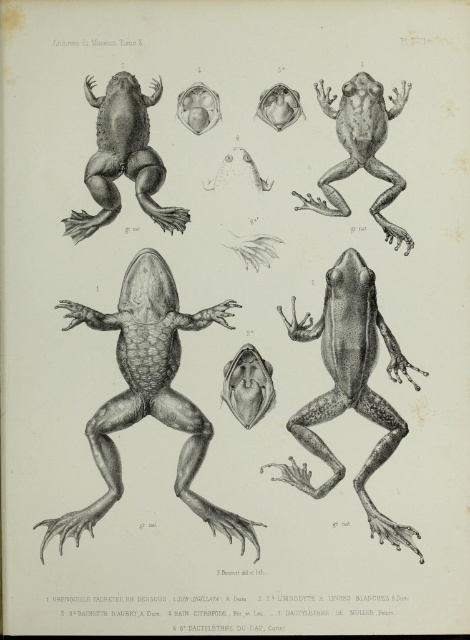
Is point (343, 410) farther from camera compared to point (345, 145)?

No, (343, 410) is in front of (345, 145).

Locate an element on the screen. The image size is (470, 640). gray textured frog at center is located at coordinates (350, 385).

Which is below, smooth black frog at upper left or smooth gray frog at upper right?

smooth gray frog at upper right is lower down.

Can you confirm if smooth black frog at upper left is bigger than smooth gray frog at upper right?

Indeed, smooth black frog at upper left has a larger size compared to smooth gray frog at upper right.

Identify the location of smooth black frog at upper left. This screenshot has width=470, height=640. (123, 157).

Does point (157, 333) come in front of point (124, 152)?

Yes, point (157, 333) is in front of point (124, 152).

The height and width of the screenshot is (640, 470). Identify the location of smooth gray frog at center. (148, 394).